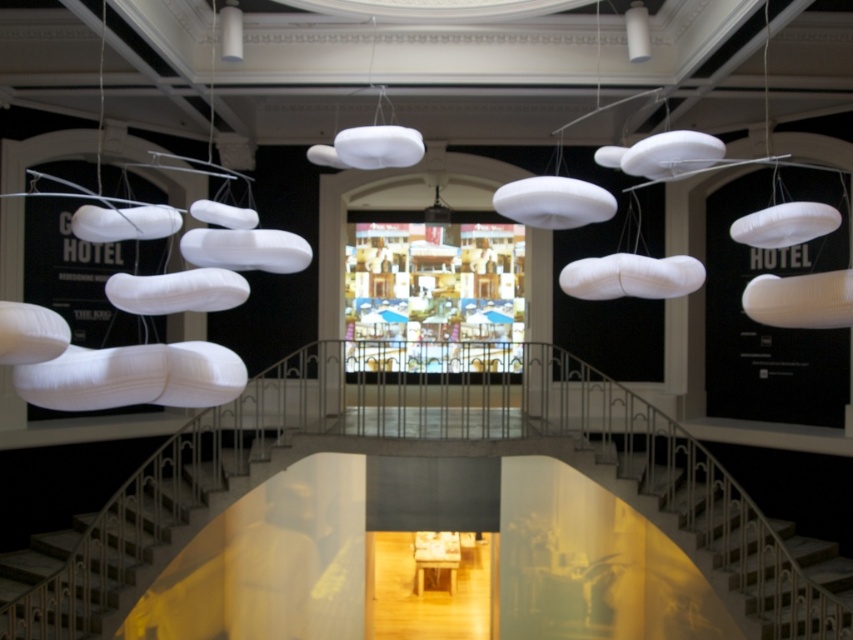
The height and width of the screenshot is (640, 853). What do you see at coordinates (376, 141) in the screenshot?
I see `white fabric cloud at center` at bounding box center [376, 141].

Between white fabric cloud at center and white fabric cloud at upper center, which one has more height?

With more height is white fabric cloud at upper center.

In the scene shown: Who is more distant from viewer, (350, 132) or (229, 19)?

The point (229, 19) is behind.

Identify the location of white fabric cloud at center. (376, 141).

Does metallic silver stairs at lower center have a greater width compared to metallic silver stairs at center?

No, metallic silver stairs at lower center is not wider than metallic silver stairs at center.

Who is lower down, metallic silver stairs at lower center or metallic silver stairs at center?

Positioned lower is metallic silver stairs at center.

Is point (183, 433) farther from viewer compared to point (770, 634)?

Yes, point (183, 433) is behind point (770, 634).

Locate an element on the screen. The image size is (853, 640). metallic silver stairs at lower center is located at coordinates (144, 528).

Where is `metallic silver stairs at lower center`? This screenshot has width=853, height=640. metallic silver stairs at lower center is located at coordinates (144, 528).

Which is in front, point (180, 474) or point (347, 160)?

Point (347, 160) is in front.

You are a GUI agent. You are given a task and a screenshot of the screen. Output one action in this format:
    pyautogui.click(x=<x>, y=<y>)
    Task: Click on the metallic silver stairs at lower center
    The height and width of the screenshot is (640, 853).
    Given the screenshot: What is the action you would take?
    pyautogui.click(x=144, y=528)